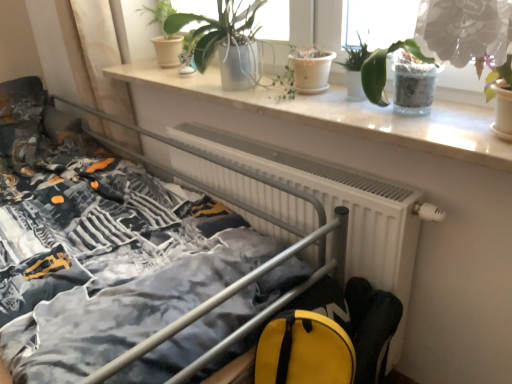
The width and height of the screenshot is (512, 384). Find the location of `vacant point to the left of green leafy plant at upper center, the 3th houseplant positioned from the left`. vacant point to the left of green leafy plant at upper center, the 3th houseplant positioned from the left is located at coordinates (294, 99).